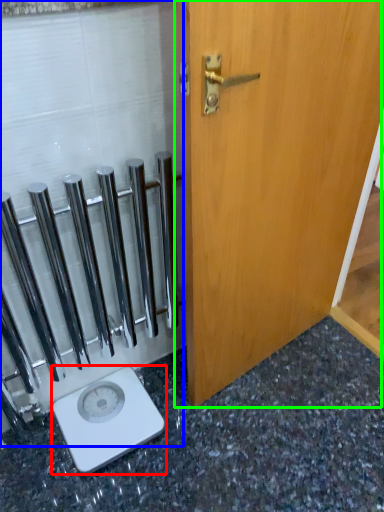
Question: Which is farther away from scale (highlighted by a red box)? glass door (highlighted by a blue box) or door (highlighted by a green box)?

Choices:
 (A) glass door
 (B) door

Answer: (B)